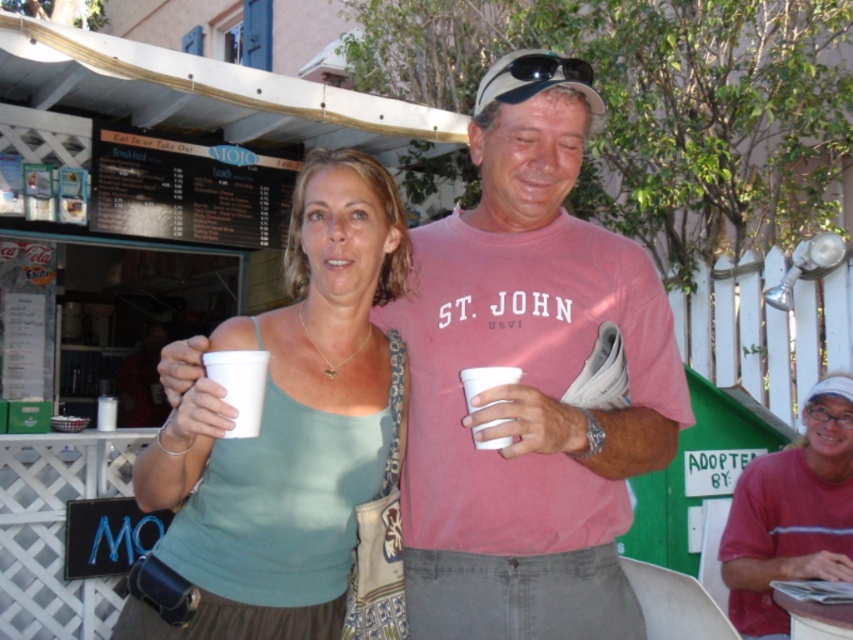
You are at a picnic and have two cups, the matte white cup at center and the white paper cup at center. You want to pour a hot drink into the larger one to avoid burning your hands. Which cup should you choose?

The matte white cup at center is larger than the white paper cup at center, so you should choose the matte white cup at center to pour the hot drink into to avoid burning your hands.

You are at a summer picnic and want to choose a cup that can hold more liquid. Which cup between the matte white cup at center and the white styrofoam cup at center is taller?

The matte white cup at center is taller than the white styrofoam cup at center, so it can hold more liquid.